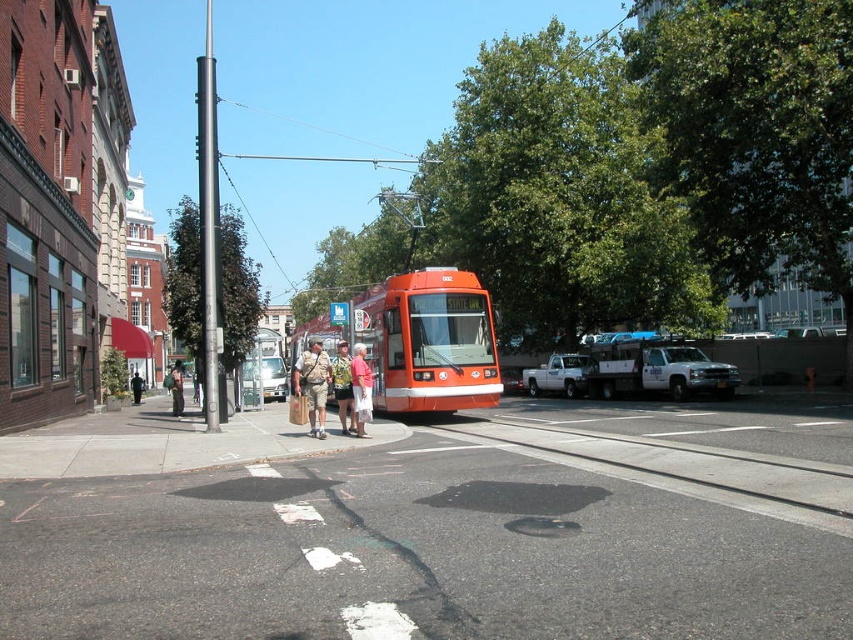
Is point (497, 378) positioned after point (318, 420)?

Yes, point (497, 378) is behind point (318, 420).

You are a GUI agent. You are given a task and a screenshot of the screen. Output one action in this format:
    pyautogui.click(x=<x>, y=<y>)
    Task: Click on the orange matte bus at center
    
    Given the screenshot: What is the action you would take?
    pyautogui.click(x=421, y=340)

I want to click on orange matte bus at center, so click(x=421, y=340).

Who is lower down, orange matte bus at center or khaki shorts at center?

khaki shorts at center

Is orange matte bus at center closer to camera compared to khaki shorts at center?

That is True.

Is point (409, 352) positioned behind point (134, 394)?

No, (409, 352) is in front of (134, 394).

Identify the location of orange matte bus at center. (421, 340).

Which of these two, orange matte bus at center or camouflage-patterned shorts at center, stands shorter?

camouflage-patterned shorts at center

What do you see at coordinates (421, 340) in the screenshot? I see `orange matte bus at center` at bounding box center [421, 340].

In order to click on orange matte bus at center in this screenshot , I will do pyautogui.click(x=421, y=340).